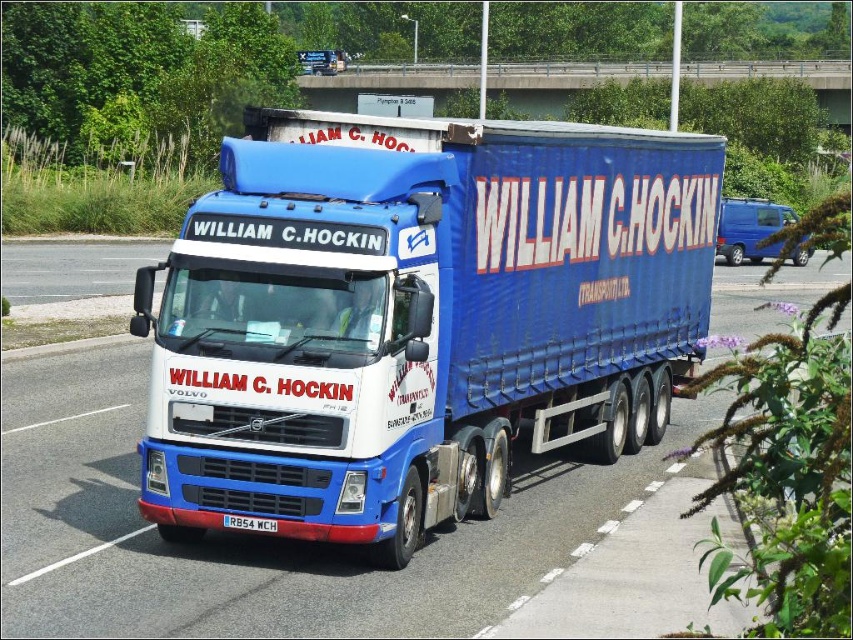
Question: Is blue fabric trailer truck at center in front of white glossy truck at center?

Choices:
 (A) yes
 (B) no

Answer: (B)

Question: Can you confirm if blue fabric trailer truck at center is positioned below white glossy truck at center?

Choices:
 (A) yes
 (B) no

Answer: (B)

Question: In this image, where is blue fabric trailer truck at center located relative to white glossy truck at center?

Choices:
 (A) below
 (B) above

Answer: (B)

Question: Based on their relative distances, which object is nearer to the blue fabric trailer truck at center?

Choices:
 (A) white plastic license plate at center
 (B) white glossy truck at center
 (C) brushed metal bridge at upper center

Answer: (B)

Question: Which point is farther to the camera?

Choices:
 (A) white plastic license plate at center
 (B) brushed metal bridge at upper center
 (C) white glossy truck at center
 (D) blue fabric trailer truck at center

Answer: (B)

Question: Which object is positioned closest to the brushed metal bridge at upper center?

Choices:
 (A) white glossy truck at center
 (B) blue fabric trailer truck at center

Answer: (A)